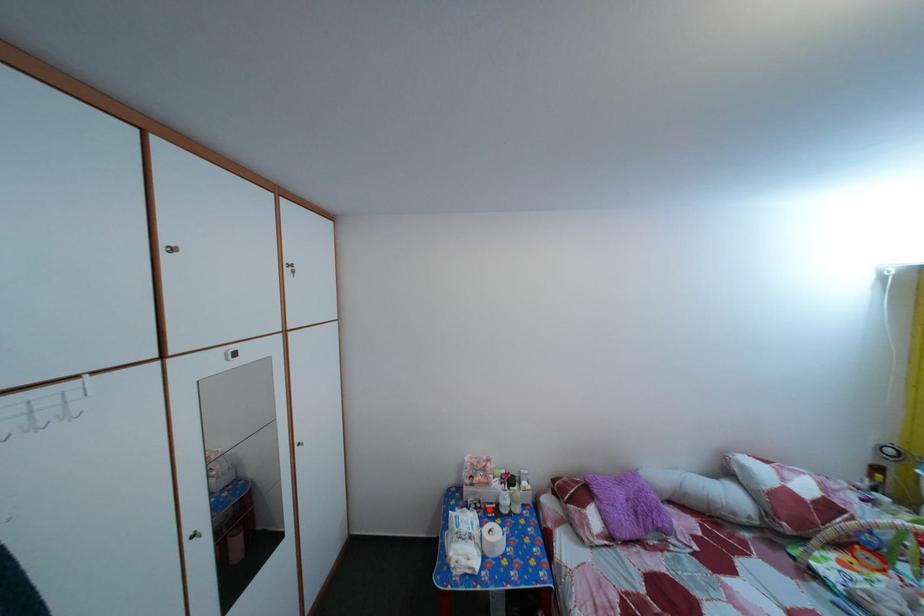
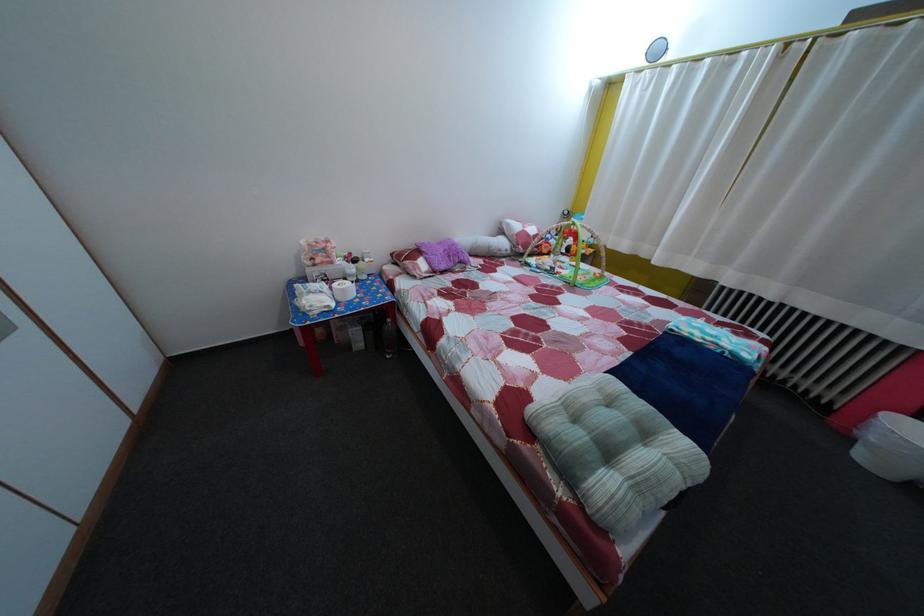
Question: I am providing you with two images of the same scene from different viewpoints. In image1, a red point is highlighted. Considering the same 3D point in image2, which of the following is correct?

Choices:
 (A) It is closer
 (B) It is farther

Answer: (A)